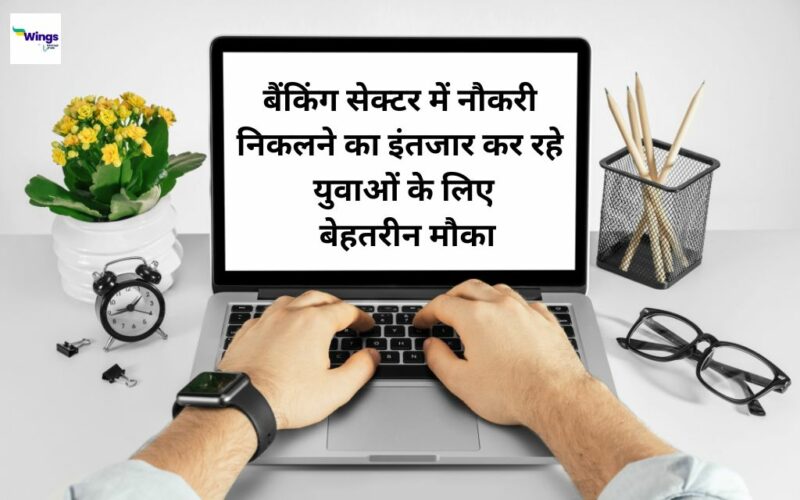
This screenshot has height=500, width=800. Find the location of `laptop screen with non-english writing on it`. laptop screen with non-english writing on it is located at coordinates pos(418,196).